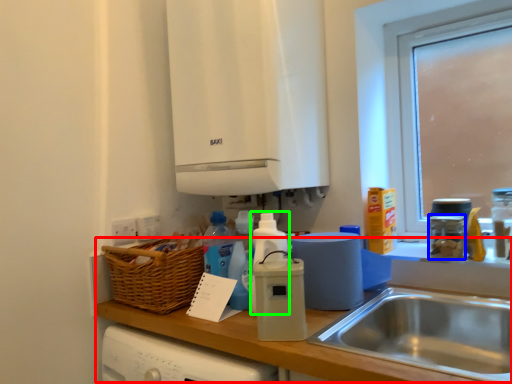
Question: Estimate the real-world distances between objects in this image. Which object is farther from counter top (highlighted by a red box), appliance (highlighted by a blue box) or bottle (highlighted by a green box)?

Choices:
 (A) appliance
 (B) bottle

Answer: (A)